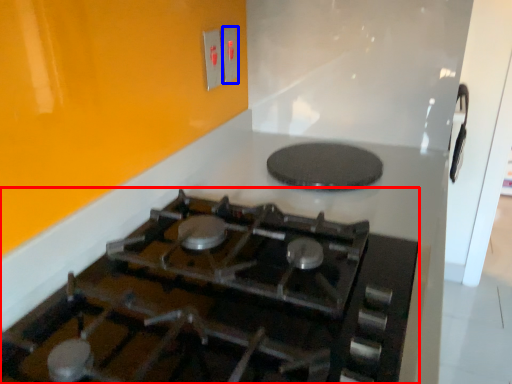
Question: Which of the following is the farthest to the observer, gas stove (highlighted by a red box) or electric outlet (highlighted by a blue box)?

Choices:
 (A) gas stove
 (B) electric outlet

Answer: (B)